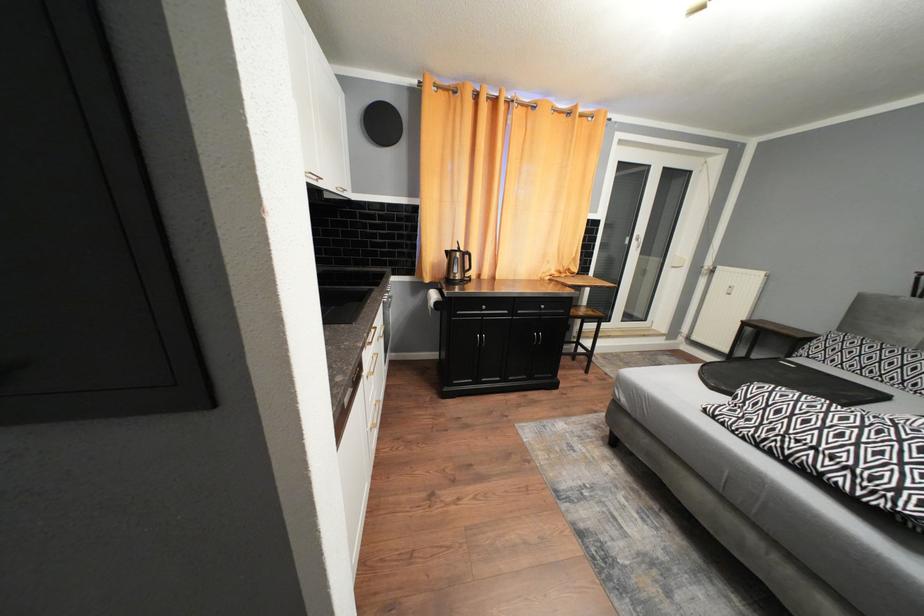
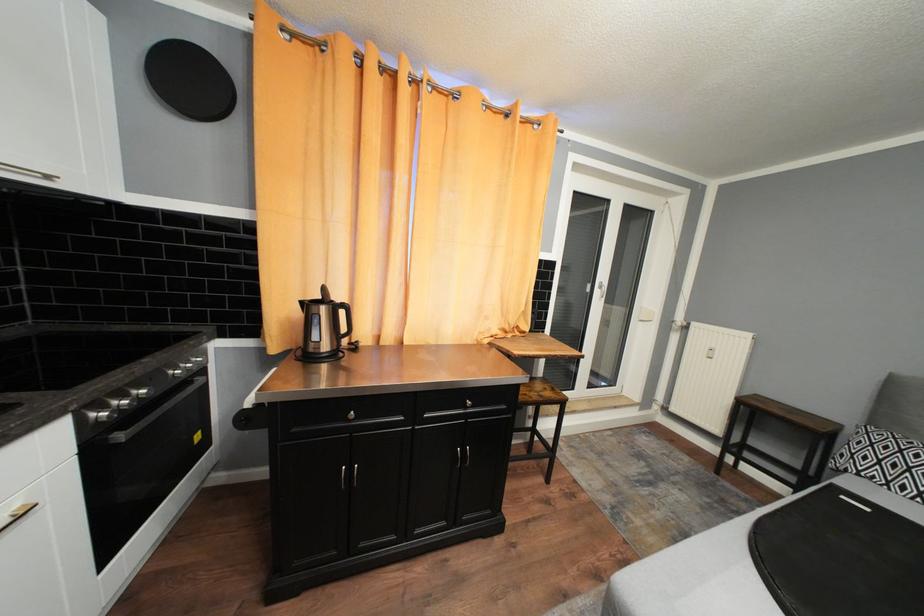
Question: The first image is from the beginning of the video and the second image is from the end. How did the camera likely rotate when shooting the video?

Choices:
 (A) Left
 (B) Right
 (C) Up
 (D) Down

Answer: (B)